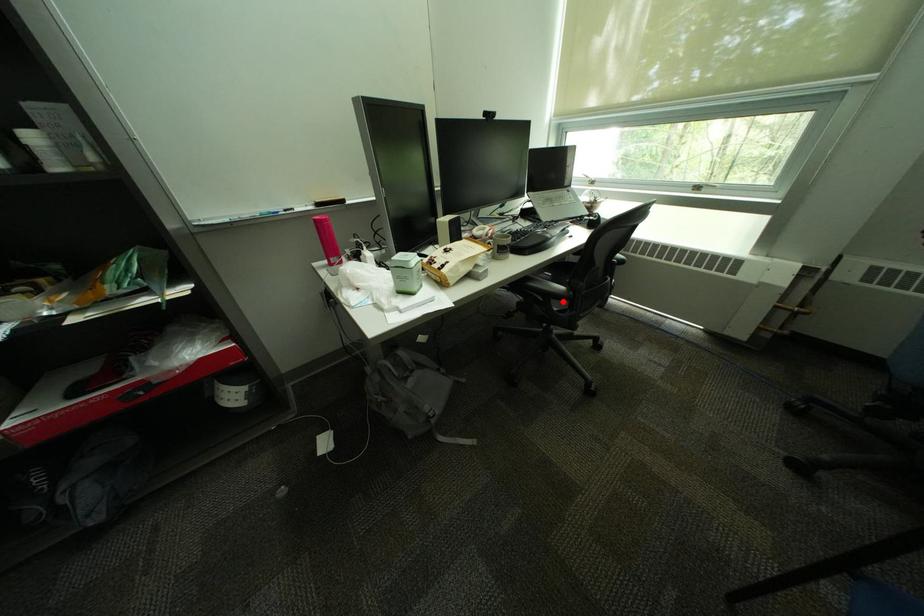
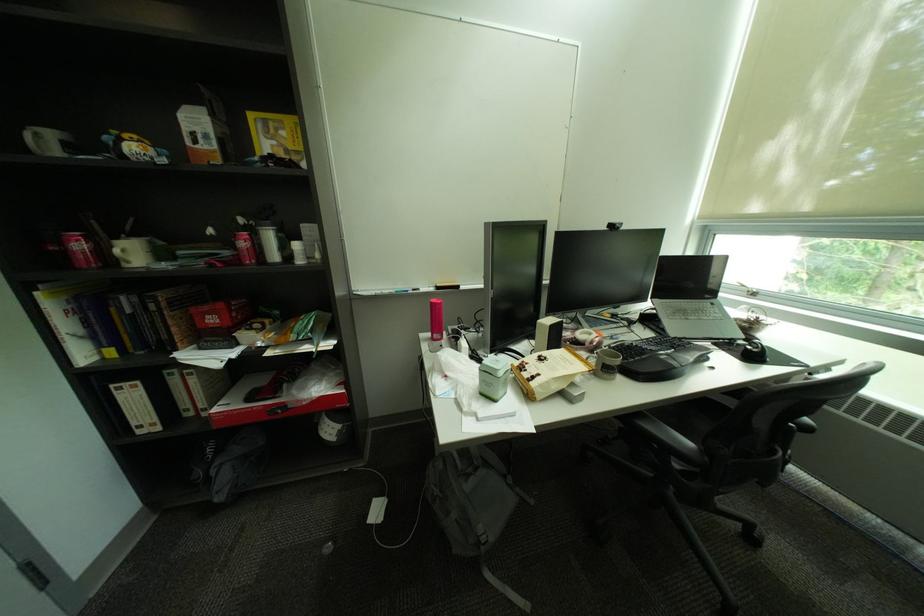
Question: I am providing you with two images of the same scene from different viewpoints. A red point is shown in image1. For the corresponding object point in image2, is it positioned nearer or farther from the camera?

Choices:
 (A) Nearer
 (B) Farther

Answer: (B)